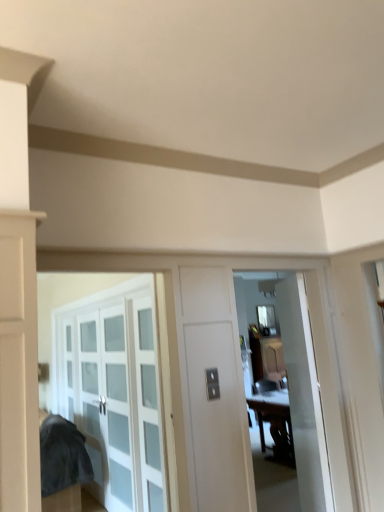
Question: Is white glossy door at center inside wooden table at center?

Choices:
 (A) no
 (B) yes

Answer: (A)

Question: From the image's perspective, is wooden table at center located beneath white glossy door at center?

Choices:
 (A) yes
 (B) no

Answer: (A)

Question: Is wooden table at center positioned behind white glossy door at center?

Choices:
 (A) yes
 (B) no

Answer: (A)

Question: From the image's perspective, is wooden table at center above white glossy door at center?

Choices:
 (A) yes
 (B) no

Answer: (B)

Question: From a real-world perspective, is wooden table at center positioned under white glossy door at center based on gravity?

Choices:
 (A) yes
 (B) no

Answer: (A)

Question: Considering the positions of white glossy door at center and clear glass window at center in the image, is white glossy door at center wider or thinner than clear glass window at center?

Choices:
 (A) thin
 (B) wide

Answer: (B)

Question: From a real-world perspective, is white glossy door at center positioned above or below clear glass window at center?

Choices:
 (A) above
 (B) below

Answer: (B)

Question: Considering the positions of white glossy door at center and clear glass window at center in the image, is white glossy door at center taller or shorter than clear glass window at center?

Choices:
 (A) tall
 (B) short

Answer: (A)

Question: Relative to clear glass window at center, is white glossy door at center in front or behind?

Choices:
 (A) front
 (B) behind

Answer: (A)

Question: In the image, is clear glass window at center on the left side or the right side of wooden table at center?

Choices:
 (A) left
 (B) right

Answer: (B)

Question: From the image's perspective, relative to wooden table at center, is clear glass window at center above or below?

Choices:
 (A) below
 (B) above

Answer: (B)

Question: In terms of size, does clear glass window at center appear bigger or smaller than wooden table at center?

Choices:
 (A) big
 (B) small

Answer: (B)

Question: In terms of width, does clear glass window at center look wider or thinner when compared to wooden table at center?

Choices:
 (A) wide
 (B) thin

Answer: (B)

Question: From the image's perspective, is wooden table at center positioned above or below clear glass window at center?

Choices:
 (A) above
 (B) below

Answer: (B)

Question: Is wooden table at center wider or thinner than clear glass window at center?

Choices:
 (A) thin
 (B) wide

Answer: (B)